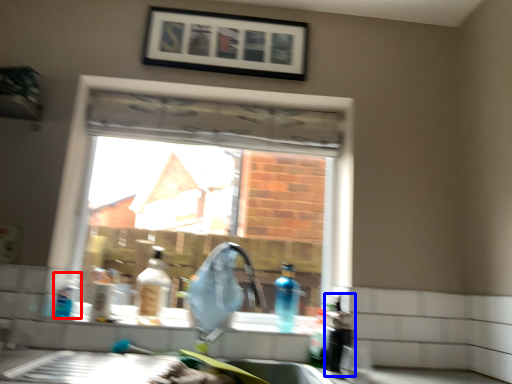
Question: Which point is further to the camera, bottle (highlighted by a red box) or bottle (highlighted by a blue box)?

Choices:
 (A) bottle
 (B) bottle

Answer: (A)